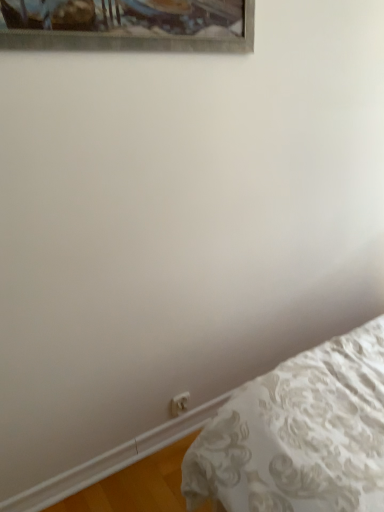
Question: Choose the correct answer: Is white plastic electric outlet at lower center inside white textured bed at lower right or outside it?

Choices:
 (A) inside
 (B) outside

Answer: (B)

Question: Considering their positions, is white plastic electric outlet at lower center located in front of or behind white textured bed at lower right?

Choices:
 (A) behind
 (B) front

Answer: (A)

Question: Is point 172,408 positioned closer to the camera than point 286,410?

Choices:
 (A) farther
 (B) closer

Answer: (A)

Question: Is white textured bed at lower right bigger or smaller than white plastic electric outlet at lower center?

Choices:
 (A) big
 (B) small

Answer: (A)

Question: From a real-world perspective, is white textured bed at lower right positioned above or below white plastic electric outlet at lower center?

Choices:
 (A) above
 (B) below

Answer: (B)

Question: In terms of width, does white textured bed at lower right look wider or thinner when compared to white plastic electric outlet at lower center?

Choices:
 (A) thin
 (B) wide

Answer: (B)

Question: Considering their positions, is white textured bed at lower right located in front of or behind white plastic electric outlet at lower center?

Choices:
 (A) behind
 (B) front

Answer: (B)